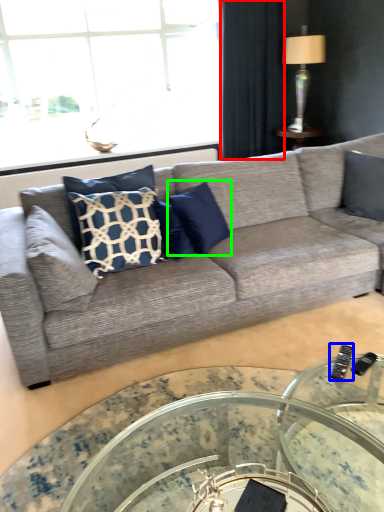
Question: Which object is the farthest from curtain (highlighted by a red box)? Choose among these: remote (highlighted by a blue box) or pillow (highlighted by a green box).

Choices:
 (A) remote
 (B) pillow

Answer: (A)